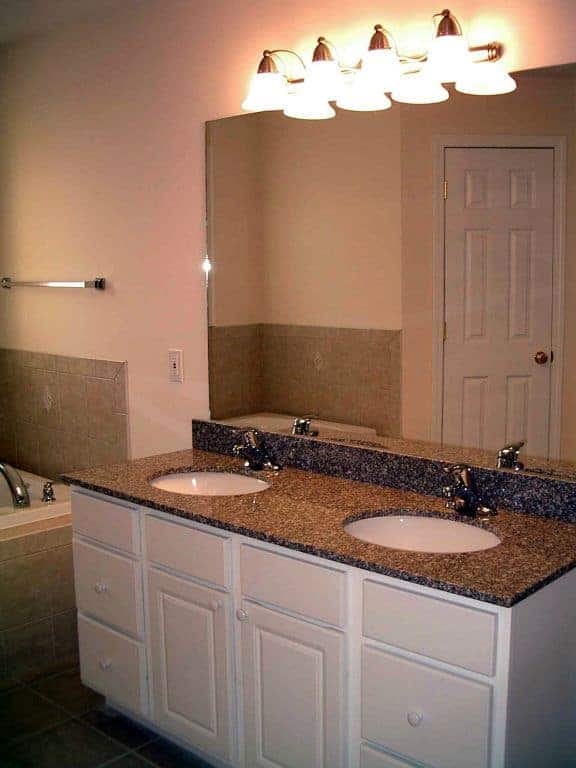
Identify the location of knob. (104, 661).